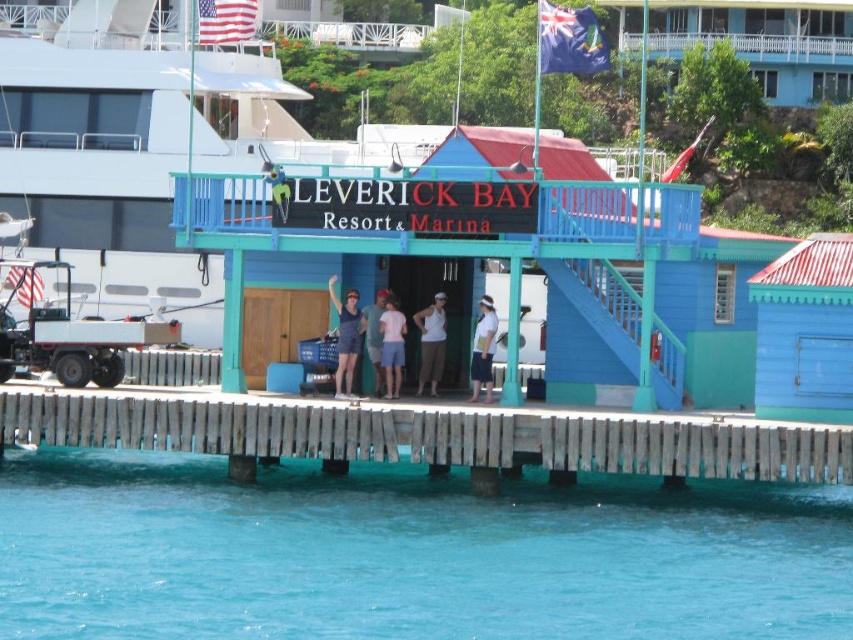
You are standing at the entrance of Leverick Bay Resort and see a blue wood hut at center and denim shorts at center. Which object is located to the right of the other?

The blue wood hut at center is positioned on the right side of denim shorts at center.

You are a photographer taking a picture of the Leverick Bay Resort entrance. You notice two people wearing pink fabric shorts at center and white fabric shirt at center. Which clothing item is located to the left of the other?

The pink fabric shorts at center is positioned on the left side of white fabric shirt at center.

You are a photographer at Leverick Bay Resort. You notice two clothing items on a mannequin in the lobby. The pink fabric shorts at center and the white fabric shirt at center. Which clothing item is positioned higher on the mannequin?

The pink fabric shorts at center is above the white fabric shirt at center, so the pink fabric shorts at center is positioned higher on the mannequin.